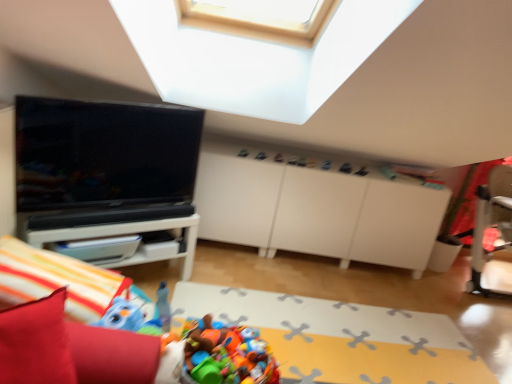
Locate an element on the screen. This screenshot has width=512, height=384. free point to the left of matte plastic toy at upper center, which is the second toy in back-to-front order is located at coordinates (261, 151).